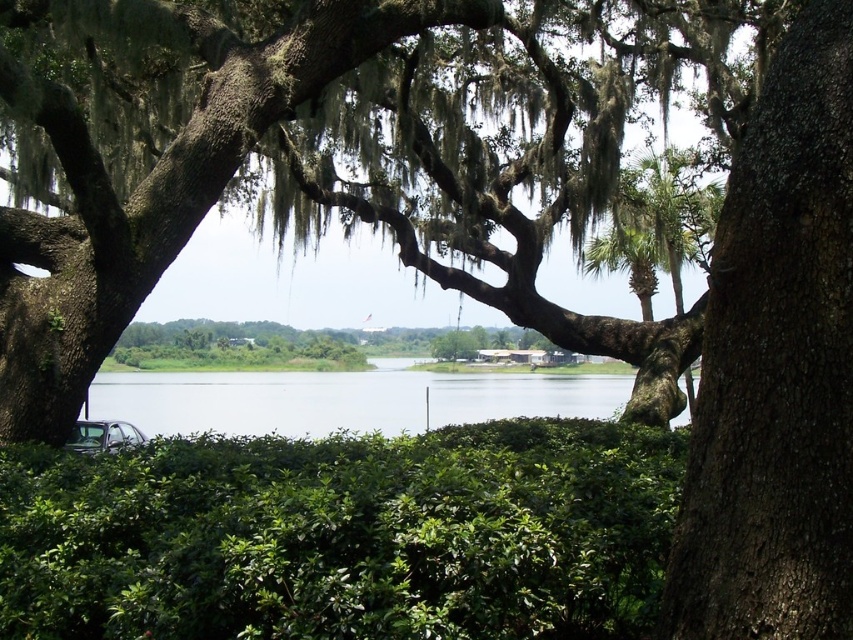
Is point (25, 500) closer to camera compared to point (120, 417)?

Yes.

Which is in front, point (341, 525) or point (438, 416)?

Point (341, 525) is more forward.

Between point (283, 608) and point (541, 388), which one is positioned in front?

Point (283, 608) is in front.

Where is `green leafy hedge at lower center`? The image size is (853, 640). green leafy hedge at lower center is located at coordinates (344, 536).